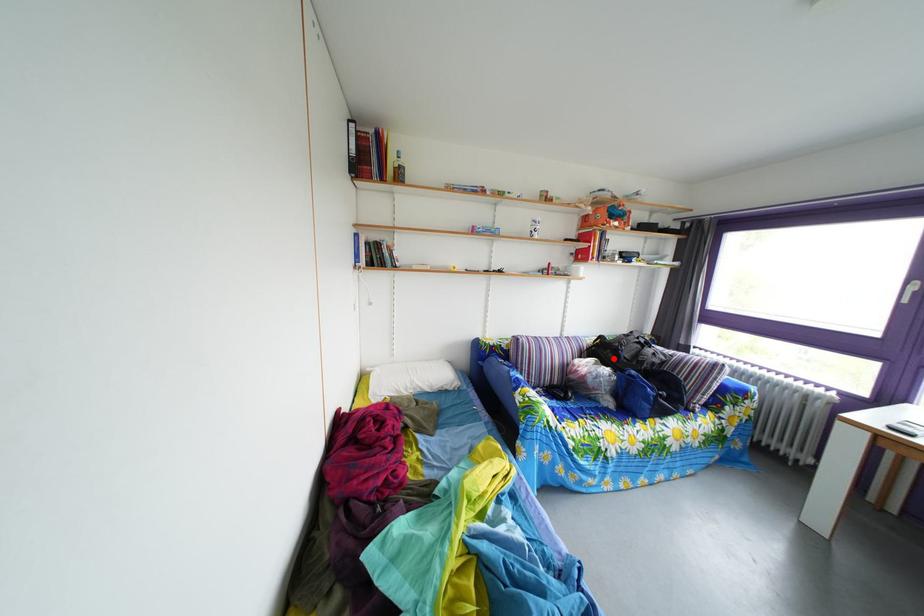
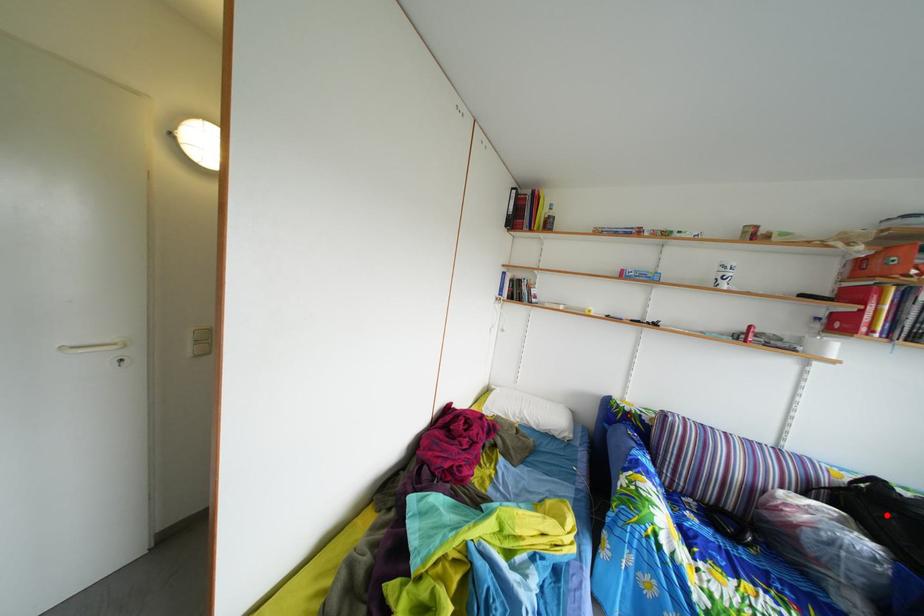
I am providing you with two images of the same scene from different viewpoints. A red point is marked on the first image and another point is marked on the second image. Is the red point in image1 aligned with the point shown in image2?

Yes